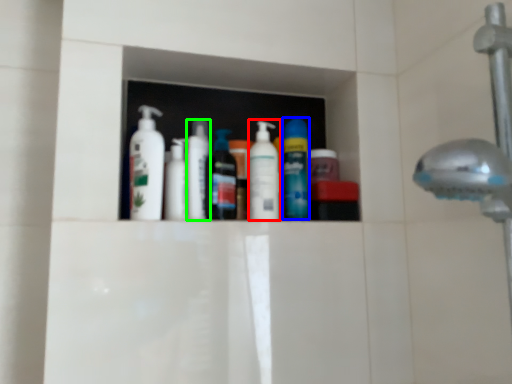
Question: Which object is the closest to the cleaning product (highlighted by a red box)? Choose among these: mouthwash (highlighted by a blue box) or toiletry (highlighted by a green box).

Choices:
 (A) mouthwash
 (B) toiletry

Answer: (A)